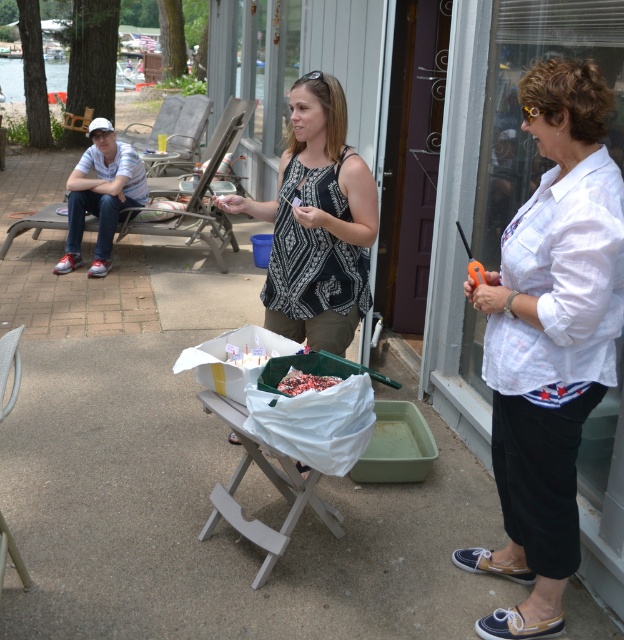
Can you confirm if white cotton shirt at center is wider than patterned fabric tank top at center?

Incorrect, white cotton shirt at center's width does not surpass patterned fabric tank top at center's.

Which is below, white cotton shirt at center or patterned fabric tank top at center?

Positioned lower is white cotton shirt at center.

From the picture: Who is more distant from viewer, [600,115] or [308,163]?

Positioned behind is point [308,163].

I want to click on white cotton shirt at center, so click(x=548, y=340).

Which of these two, patterned fabric tank top at center or chocolate cake at center, stands shorter?

With less height is chocolate cake at center.

Locate an element on the screen. patterned fabric tank top at center is located at coordinates (316, 224).

Locate an element on the screen. Image resolution: width=624 pixels, height=640 pixels. patterned fabric tank top at center is located at coordinates pyautogui.click(x=316, y=224).

Does white cotton shirt at center have a lesser height compared to chocolate cake at center?

No, white cotton shirt at center is not shorter than chocolate cake at center.

Is white cotton shirt at center to the right of chocolate cake at center from the viewer's perspective?

Yes, white cotton shirt at center is to the right of chocolate cake at center.

Is point (500, 609) more distant than point (329, 376)?

No, it is not.

Find the location of a particular element. white cotton shirt at center is located at coordinates (548, 340).